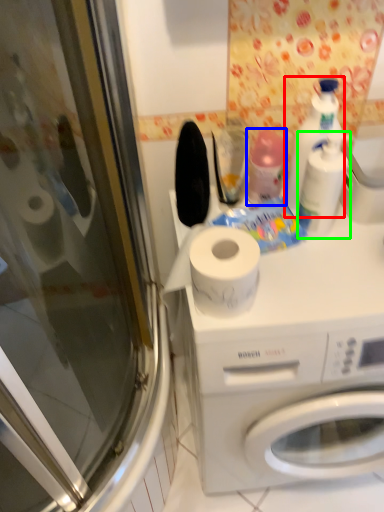
Question: Which is nearer to the cleaning product (highlighted by a red box)? cleaning product (highlighted by a blue box) or cleaning product (highlighted by a green box).

Choices:
 (A) cleaning product
 (B) cleaning product

Answer: (B)